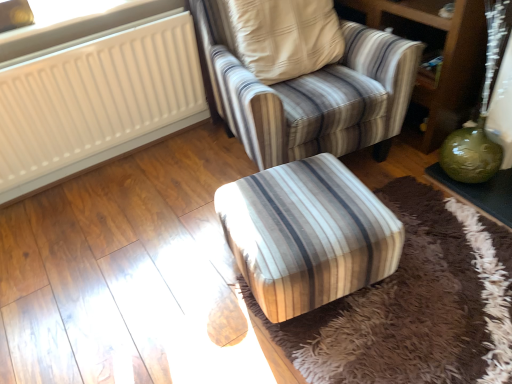
At what (x,y) coordinates should I click in order to perform the action: click on free point in front of striped fabric ottoman at center. Please return your answer as a coordinate pair (x, y). This screenshot has height=384, width=512. Looking at the image, I should click on (372, 346).